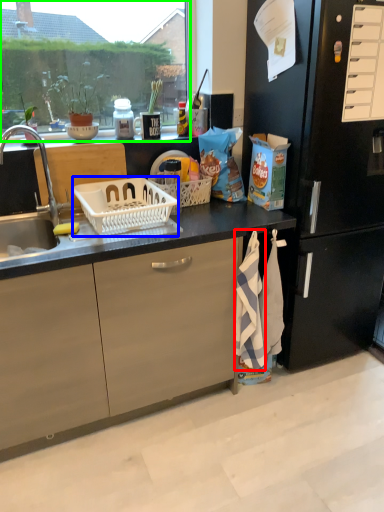
Question: Considering the real-world distances, which object is closest to beach towel (highlighted by a red box)? picnic basket (highlighted by a blue box) or window screen (highlighted by a green box).

Choices:
 (A) picnic basket
 (B) window screen

Answer: (A)